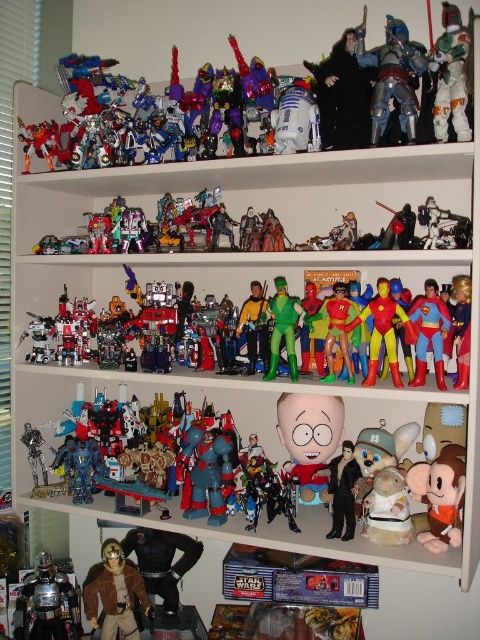
You are a collector organizing your toy shelves. You want to place a new toy that requires a spot in front of the multicolored plastic action figure at center. Is the white plastic boba fett at upper center currently blocking that spot?

The white plastic boba fett at upper center is in front of the multicolored plastic action figure at center, so it is blocking the desired spot.

Consider the image. Looking at the arrangement of toys on the shelves, where is the metallic silver armor at upper right located in relation to the shiny metallic robots at center?

The metallic silver armor at upper right is located to the right of the shiny metallic robots at center.

You are standing 1.2 meters away from the camera. You want to reach the point at coordinates point (x=381, y=83). Can you reach it without moving closer?

The distance of point (x=381, y=83) from camera is 1.10 meters, so since you are 1.2 meters away from the camera, you can reach it without moving closer.